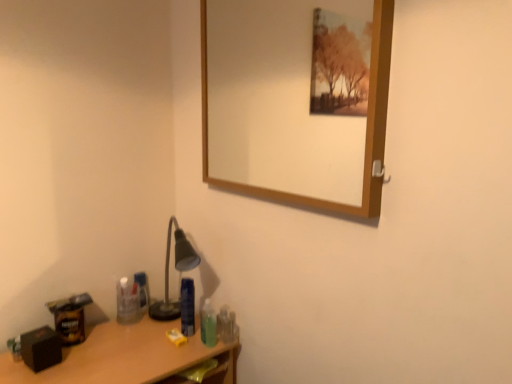
This screenshot has width=512, height=384. What do you see at coordinates (128, 357) in the screenshot?
I see `wooden desk at lower left` at bounding box center [128, 357].

What do you see at coordinates (208, 324) in the screenshot? I see `translucent plastic bottle at lower center, the first toiletry from the front` at bounding box center [208, 324].

How much space does translucent plastic toothbrush at lower right, the 2th toiletry positioned from the front, occupy vertically?

4.78 inches.

This screenshot has width=512, height=384. What do you see at coordinates (187, 307) in the screenshot?
I see `blue plastic bottle at lower center, the 3th toiletry positioned from the front` at bounding box center [187, 307].

In order to face translucent plastic bottle at center, which is the 1th toiletry in back-to-front order, should I rotate leftwards or rightwards?

A 14.985 degree turn to the left will do.

This screenshot has width=512, height=384. Find the location of `wooden desk at lower left`. wooden desk at lower left is located at coordinates [128, 357].

Is translucent plastic bottle at center, which is the first toiletry in left-to-right order, inside wooden desk at lower left?

Definitely not — translucent plastic bottle at center, which is the first toiletry in left-to-right order, is not inside wooden desk at lower left.

Can you confirm if wooden desk at lower left is smaller than translucent plastic bottle at center, which is the first toiletry in left-to-right order?

No.

From the image's perspective, is wooden desk at lower left on top of translucent plastic bottle at center, which is the first toiletry in left-to-right order?

No, from the image's perspective, wooden desk at lower left is not on top of translucent plastic bottle at center, which is the first toiletry in left-to-right order.

This screenshot has width=512, height=384. I want to click on desk in front of the translucent plastic bottle at center, arranged as the fourth toiletry when viewed from the right, so click(128, 357).

Is translucent plastic bottle at center, which is the first toiletry in left-to-right order, not close to wooden desk at lower left?

No, translucent plastic bottle at center, which is the first toiletry in left-to-right order, is not far away from wooden desk at lower left.

Which of these two, translucent plastic bottle at center, arranged as the fourth toiletry when viewed from the right, or wooden desk at lower left, stands shorter?

Standing shorter between the two is translucent plastic bottle at center, arranged as the fourth toiletry when viewed from the right.

Which is behind, translucent plastic bottle at center, positioned as the 4th toiletry in front-to-back order, or wooden desk at lower left?

translucent plastic bottle at center, positioned as the 4th toiletry in front-to-back order, is more distant.

From the image's perspective, which is above, translucent plastic toothbrush at lower right, the first toiletry from the right, or blue plastic bottle at lower center, the 2th toiletry from the left?

blue plastic bottle at lower center, the 2th toiletry from the left.

Considering the relative sizes of translucent plastic toothbrush at lower right, which appears as the fourth toiletry when viewed from the left, and blue plastic bottle at lower center, the 3th toiletry positioned from the front, in the image provided, is translucent plastic toothbrush at lower right, which appears as the fourth toiletry when viewed from the left, shorter than blue plastic bottle at lower center, the 3th toiletry positioned from the front,?

Indeed, translucent plastic toothbrush at lower right, which appears as the fourth toiletry when viewed from the left, has a lesser height compared to blue plastic bottle at lower center, the 3th toiletry positioned from the front.

How many degrees apart are the facing directions of translucent plastic toothbrush at lower right, the first toiletry from the right, and blue plastic bottle at lower center, the 2th toiletry from the left?

0.00721 degrees.

Is blue plastic bottle at lower center, the 2th toiletry from the left, surrounded by translucent plastic toothbrush at lower right, the 2th toiletry positioned from the front?

No, blue plastic bottle at lower center, the 2th toiletry from the left, is not a part of translucent plastic toothbrush at lower right, the 2th toiletry positioned from the front.

How different are the orientations of wooden-framed mirror at upper center and translucent plastic bottle at lower center, the first toiletry from the front, in degrees?

The facing directions of wooden-framed mirror at upper center and translucent plastic bottle at lower center, the first toiletry from the front, are 79.1 degrees apart.

Which object is positioned more to the left, wooden-framed mirror at upper center or translucent plastic bottle at lower center, the 3th toiletry positioned from the left?

translucent plastic bottle at lower center, the 3th toiletry positioned from the left, is more to the left.

Is wooden-framed mirror at upper center inside or outside of translucent plastic bottle at lower center, which appears as the 2th toiletry when viewed from the right?

wooden-framed mirror at upper center lies outside translucent plastic bottle at lower center, which appears as the 2th toiletry when viewed from the right.

From a real-world perspective, is translucent plastic bottle at center, which is the 1th toiletry in back-to-front order, above or below translucent plastic toothbrush at lower right, which appears as the fourth toiletry when viewed from the left?

translucent plastic bottle at center, which is the 1th toiletry in back-to-front order, is situated higher than translucent plastic toothbrush at lower right, which appears as the fourth toiletry when viewed from the left, in the real world.

Is translucent plastic bottle at center, arranged as the fourth toiletry when viewed from the right, not close to translucent plastic toothbrush at lower right, which is counted as the 3th toiletry, starting from the back?

No, there isn't a large distance between translucent plastic bottle at center, arranged as the fourth toiletry when viewed from the right, and translucent plastic toothbrush at lower right, which is counted as the 3th toiletry, starting from the back.

Is translucent plastic bottle at center, which is the 1th toiletry in back-to-front order, to the right of translucent plastic toothbrush at lower right, which is counted as the 3th toiletry, starting from the back, from the viewer's perspective?

In fact, translucent plastic bottle at center, which is the 1th toiletry in back-to-front order, is to the left of translucent plastic toothbrush at lower right, which is counted as the 3th toiletry, starting from the back.

How many degrees apart are the facing directions of translucent plastic bottle at center, arranged as the fourth toiletry when viewed from the right, and translucent plastic toothbrush at lower right, which is counted as the 3th toiletry, starting from the back?

The angular difference between translucent plastic bottle at center, arranged as the fourth toiletry when viewed from the right, and translucent plastic toothbrush at lower right, which is counted as the 3th toiletry, starting from the back, is 9.59 degrees.

Considering the sizes of objects blue plastic bottle at lower center, the 3th toiletry positioned from the front, and wooden-framed mirror at upper center in the image provided, who is wider, blue plastic bottle at lower center, the 3th toiletry positioned from the front, or wooden-framed mirror at upper center?

wooden-framed mirror at upper center is wider.

From a real-world perspective, is blue plastic bottle at lower center, marked as the 3th toiletry in a right-to-left arrangement, positioned over wooden-framed mirror at upper center based on gravity?

No, from a real-world perspective, blue plastic bottle at lower center, marked as the 3th toiletry in a right-to-left arrangement, is not on top of wooden-framed mirror at upper center.

From the image's perspective, does blue plastic bottle at lower center, the 2th toiletry from the left, appear lower than wooden-framed mirror at upper center?

Indeed, from the image's perspective, blue plastic bottle at lower center, the 2th toiletry from the left, is shown beneath wooden-framed mirror at upper center.

Considering the relative sizes of blue plastic bottle at lower center, the 2th toiletry from the left, and wooden-framed mirror at upper center in the image provided, is blue plastic bottle at lower center, the 2th toiletry from the left, smaller than wooden-framed mirror at upper center?

Yes.

Relative to translucent plastic bottle at center, arranged as the fourth toiletry when viewed from the right, is translucent plastic toothbrush at lower right, which appears as the fourth toiletry when viewed from the left, in front or behind?

Clearly, translucent plastic toothbrush at lower right, which appears as the fourth toiletry when viewed from the left, is in front of translucent plastic bottle at center, arranged as the fourth toiletry when viewed from the right.

Does translucent plastic toothbrush at lower right, the 2th toiletry positioned from the front, have a greater height compared to translucent plastic bottle at center, arranged as the fourth toiletry when viewed from the right?

No, translucent plastic toothbrush at lower right, the 2th toiletry positioned from the front, is not taller than translucent plastic bottle at center, arranged as the fourth toiletry when viewed from the right.

From the picture: Considering the positions of objects translucent plastic toothbrush at lower right, the first toiletry from the right, and translucent plastic bottle at center, which is the 1th toiletry in back-to-front order, in the image provided, who is more to the right, translucent plastic toothbrush at lower right, the first toiletry from the right, or translucent plastic bottle at center, which is the 1th toiletry in back-to-front order,?

translucent plastic toothbrush at lower right, the first toiletry from the right, is more to the right.

From a real-world perspective, is translucent plastic toothbrush at lower right, the first toiletry from the right, positioned over translucent plastic bottle at center, which is the first toiletry in left-to-right order, based on gravity?

No, from a real-world perspective, translucent plastic toothbrush at lower right, the first toiletry from the right, is not above translucent plastic bottle at center, which is the first toiletry in left-to-right order.

Image resolution: width=512 pixels, height=384 pixels. I want to click on the 3rd toiletry above the wooden desk at lower left (from the image's perspective), so click(142, 290).

Where is `desk on the left of translucent plastic bottle at center, positioned as the 4th toiletry in front-to-back order`? The height and width of the screenshot is (384, 512). desk on the left of translucent plastic bottle at center, positioned as the 4th toiletry in front-to-back order is located at coordinates (x=128, y=357).

Estimate the real-world distances between objects in this image. Which object is closer to wooden-framed mirror at upper center, translucent plastic bottle at center, which is the 1th toiletry in back-to-front order, or translucent plastic toothbrush at lower right, which is counted as the 3th toiletry, starting from the back?

translucent plastic bottle at center, which is the 1th toiletry in back-to-front order, is positioned closer to the anchor wooden-framed mirror at upper center.

Based on their spatial positions, is translucent plastic bottle at center, which is the first toiletry in left-to-right order, or translucent plastic toothbrush at lower right, the first toiletry from the right, further from wooden desk at lower left?

Among the two, translucent plastic bottle at center, which is the first toiletry in left-to-right order, is located further to wooden desk at lower left.

Which object lies further to the anchor point wooden-framed mirror at upper center, translucent plastic toothbrush at lower right, the 2th toiletry positioned from the front, or blue plastic bottle at lower center, the 2th toiletry when ordered from back to front?

Based on the image, translucent plastic toothbrush at lower right, the 2th toiletry positioned from the front, appears to be further to wooden-framed mirror at upper center.

When comparing their distances from wooden-framed mirror at upper center, does translucent plastic bottle at center, positioned as the 4th toiletry in front-to-back order, or translucent plastic bottle at lower center, the 3th toiletry positioned from the left, seem further?

translucent plastic bottle at center, positioned as the 4th toiletry in front-to-back order, is positioned further to the anchor wooden-framed mirror at upper center.

Looking at the image, which one is located further to translucent plastic toothbrush at lower right, which is counted as the 3th toiletry, starting from the back, wooden-framed mirror at upper center or translucent plastic bottle at center, arranged as the fourth toiletry when viewed from the right?

Based on the image, wooden-framed mirror at upper center appears to be further to translucent plastic toothbrush at lower right, which is counted as the 3th toiletry, starting from the back.

Which object lies nearer to the anchor point translucent plastic bottle at lower center, which is counted as the fourth toiletry, starting from the back, blue plastic bottle at lower center, the 3th toiletry positioned from the front, or translucent plastic bottle at center, arranged as the fourth toiletry when viewed from the right?

blue plastic bottle at lower center, the 3th toiletry positioned from the front.

Based on the photo, from the image, which object appears to be nearer to wooden-framed mirror at upper center, translucent plastic bottle at lower center, which appears as the 2th toiletry when viewed from the right, or blue plastic bottle at lower center, marked as the 3th toiletry in a right-to-left arrangement?

blue plastic bottle at lower center, marked as the 3th toiletry in a right-to-left arrangement, is closer to wooden-framed mirror at upper center.

When comparing their distances from translucent plastic bottle at lower center, which is counted as the fourth toiletry, starting from the back, does blue plastic bottle at lower center, the 2th toiletry from the left, or wooden-framed mirror at upper center seem closer?

blue plastic bottle at lower center, the 2th toiletry from the left.

The height and width of the screenshot is (384, 512). What are the coordinates of `toiletry situated between translucent plastic bottle at center, which is the first toiletry in left-to-right order, and translucent plastic bottle at lower center, which appears as the 2th toiletry when viewed from the right, from left to right` in the screenshot? It's located at coord(187,307).

Where is `toiletry between wooden desk at lower left and translucent plastic toothbrush at lower right, the 2th toiletry positioned from the front, in the front-back direction`? The width and height of the screenshot is (512, 384). toiletry between wooden desk at lower left and translucent plastic toothbrush at lower right, the 2th toiletry positioned from the front, in the front-back direction is located at coordinates tap(208, 324).

At what (x,y) coordinates should I click in order to perform the action: click on toiletry between blue plastic bottle at lower center, marked as the 3th toiletry in a right-to-left arrangement, and translucent plastic toothbrush at lower right, which appears as the fourth toiletry when viewed from the left. Please return your answer as a coordinate pair (x, y). This screenshot has height=384, width=512. Looking at the image, I should click on (208, 324).